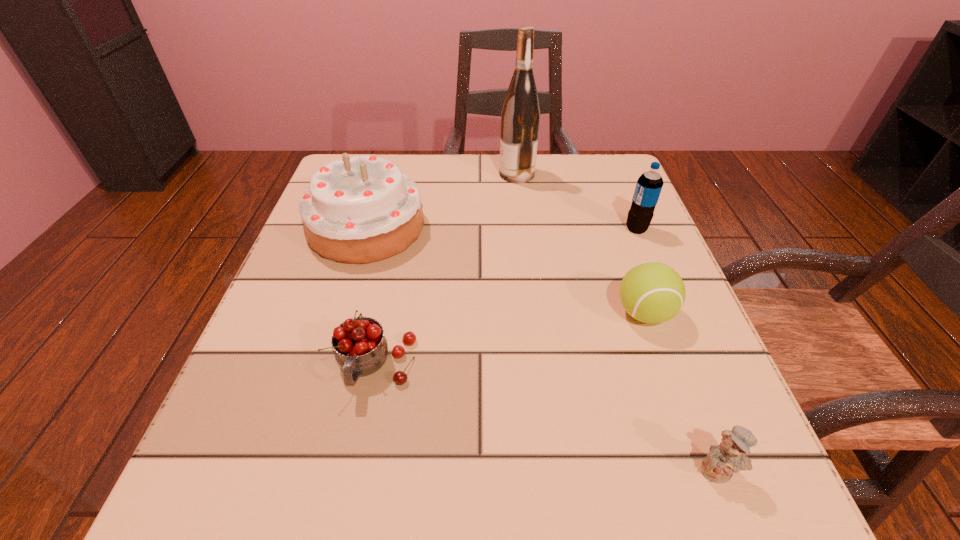
You are a GUI agent. You are given a task and a screenshot of the screen. Output one action in this format:
    pyautogui.click(x=<x>, y=<y>)
    Task: Click on the wine bottle
    The width and height of the screenshot is (960, 540).
    Given the screenshot: What is the action you would take?
    pyautogui.click(x=520, y=117)

You are a GUI agent. You are given a task and a screenshot of the screen. Output one action in this format:
    pyautogui.click(x=<x>, y=<y>)
    Task: Click on the tallest object
    This screenshot has width=960, height=540.
    Given the screenshot: What is the action you would take?
    pyautogui.click(x=520, y=117)

Find the location of `cake`. cake is located at coordinates (362, 209).

Identify the location of soda bottle. (649, 185).

Locate an element on the screen. cherry is located at coordinates (360, 347).

I want to click on tennis ball, so click(x=651, y=292).

Where is `teddy bear`? This screenshot has width=960, height=540. teddy bear is located at coordinates (729, 456).

Find the location of a particular element. vacant space situated 0.080m on the left of the tallest object is located at coordinates (467, 174).

Find the location of a particular element. Image resolution: width=960 pixels, height=540 pixels. blank space located on the right of the cake is located at coordinates (468, 227).

Locate an element on the screen. The width and height of the screenshot is (960, 540). vacant space located on the front of the soda bottle is located at coordinates (709, 404).